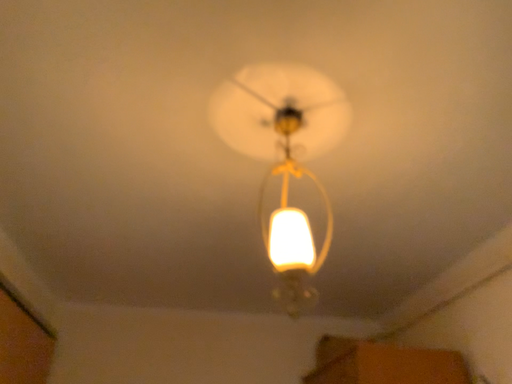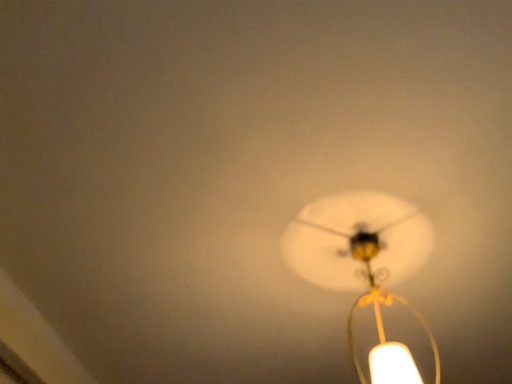
Question: How did the camera likely rotate when shooting the video?

Choices:
 (A) rotated right
 (B) rotated left

Answer: (B)